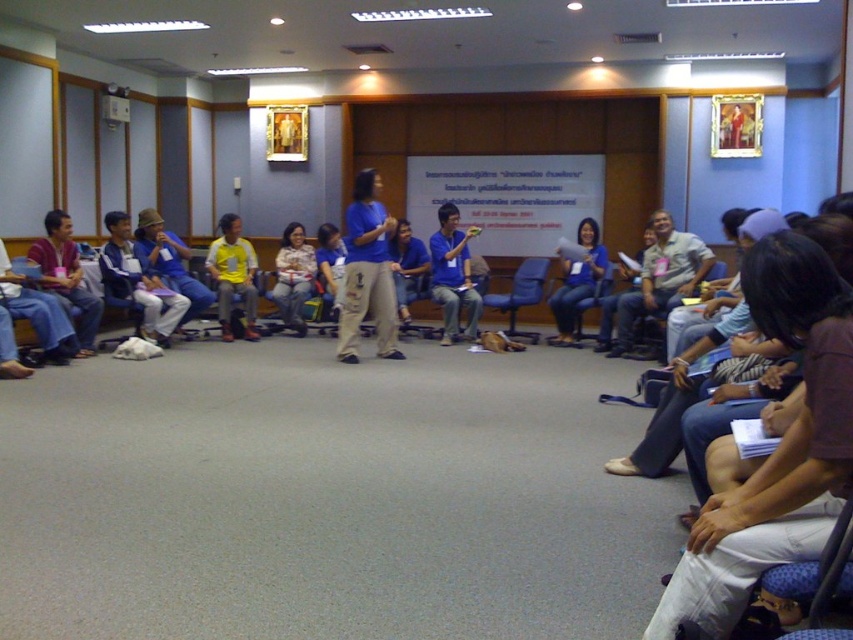
Is matte blue shirt at center to the right of matte plastic chair at center from the viewer's perspective?

No, matte blue shirt at center is not to the right of matte plastic chair at center.

Is matte blue shirt at center shorter than matte plastic chair at center?

No, matte blue shirt at center is not shorter than matte plastic chair at center.

The height and width of the screenshot is (640, 853). What do you see at coordinates (576, 282) in the screenshot?
I see `matte blue shirt at center` at bounding box center [576, 282].

Where is `matte blue shirt at center`? The width and height of the screenshot is (853, 640). matte blue shirt at center is located at coordinates (576, 282).

Does metallic blue chair at center have a lesser height compared to matte plastic chair at center?

Correct, metallic blue chair at center is not as tall as matte plastic chair at center.

I want to click on metallic blue chair at center, so click(x=409, y=289).

I want to click on matte blue shirt at center, so click(x=576, y=282).

Locate an element on the screen. The height and width of the screenshot is (640, 853). matte blue shirt at center is located at coordinates (576, 282).